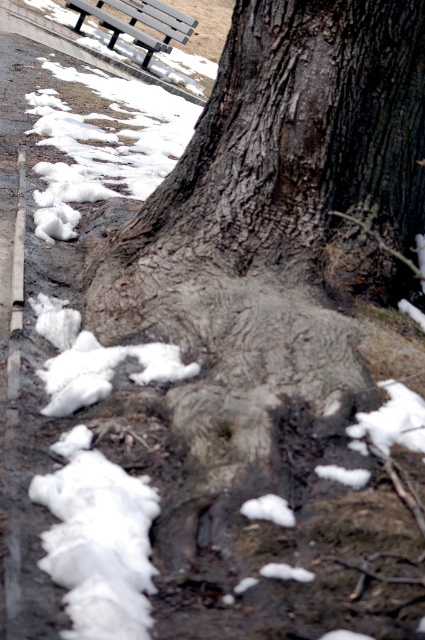
Can you confirm if gray rough bark tree at center is thinner than metallic gray bench at upper left?

Correct, gray rough bark tree at center's width is less than metallic gray bench at upper left's.

Who is more distant from viewer, (299, 464) or (124, 26)?

The point (124, 26) is more distant.

Find the location of a particular element. The width and height of the screenshot is (425, 640). gray rough bark tree at center is located at coordinates (272, 243).

Which of these two, gray rough bark tree at center or white fluffy snow at lower left, stands shorter?

white fluffy snow at lower left

Describe the element at coordinates (272, 243) in the screenshot. This screenshot has width=425, height=640. I see `gray rough bark tree at center` at that location.

Where is `gray rough bark tree at center`? The width and height of the screenshot is (425, 640). gray rough bark tree at center is located at coordinates (272, 243).

Does white fluffy snow at lower left have a greater height compared to metallic gray bench at upper left?

In fact, white fluffy snow at lower left may be shorter than metallic gray bench at upper left.

Does point (85, 570) come closer to viewer compared to point (138, 8)?

That is True.

Where is `white fluffy snow at lower left`? This screenshot has width=425, height=640. white fluffy snow at lower left is located at coordinates (98, 540).

Where is `white fluffy snow at lower left`? Image resolution: width=425 pixels, height=640 pixels. white fluffy snow at lower left is located at coordinates (98, 540).